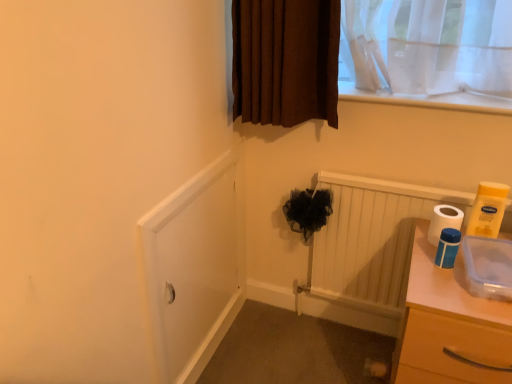
Question: Is blue plastic toilet paper at right, which is the third toilet paper from right to left, completely or partially inside white glossy toilet paper at right, which is counted as the 3th toilet paper, starting from the left?

Choices:
 (A) no
 (B) yes

Answer: (A)

Question: Are white glossy toilet paper at right, the first toilet paper when ordered from right to left, and blue plastic toilet paper at right, marked as the first toilet paper in a left-to-right arrangement, beside each other?

Choices:
 (A) no
 (B) yes

Answer: (A)

Question: Is white glossy toilet paper at right, which is counted as the 3th toilet paper, starting from the left, positioned in front of blue plastic toilet paper at right, which is the third toilet paper from right to left?

Choices:
 (A) yes
 (B) no

Answer: (B)

Question: Is white glossy toilet paper at right, which is counted as the 3th toilet paper, starting from the left, oriented away from blue plastic toilet paper at right, marked as the first toilet paper in a left-to-right arrangement?

Choices:
 (A) yes
 (B) no

Answer: (B)

Question: Could you tell me if white glossy toilet paper at right, the first toilet paper when ordered from right to left, is turned towards blue plastic toilet paper at right, marked as the first toilet paper in a left-to-right arrangement?

Choices:
 (A) no
 (B) yes

Answer: (A)

Question: From the image's perspective, is white matte screen door at lower left above or below white matte toilet paper at right, placed as the second toilet paper when sorted from left to right?

Choices:
 (A) below
 (B) above

Answer: (A)

Question: Is white matte screen door at lower left taller or shorter than white matte toilet paper at right, which ranks as the second toilet paper in right-to-left order?

Choices:
 (A) short
 (B) tall

Answer: (B)

Question: Is white matte screen door at lower left bigger or smaller than white matte toilet paper at right, which ranks as the second toilet paper in right-to-left order?

Choices:
 (A) big
 (B) small

Answer: (A)

Question: Considering the positions of point (185, 345) and point (453, 226), is point (185, 345) closer or farther from the camera than point (453, 226)?

Choices:
 (A) farther
 (B) closer

Answer: (A)

Question: Is clear plastic chest of drawers at right taller or shorter than blue plastic toilet paper at right, marked as the first toilet paper in a left-to-right arrangement?

Choices:
 (A) short
 (B) tall

Answer: (B)

Question: Considering their positions, is clear plastic chest of drawers at right located in front of or behind blue plastic toilet paper at right, which is the third toilet paper from right to left?

Choices:
 (A) front
 (B) behind

Answer: (A)

Question: Visually, is clear plastic chest of drawers at right positioned to the left or to the right of blue plastic toilet paper at right, which is the third toilet paper from right to left?

Choices:
 (A) right
 (B) left

Answer: (A)

Question: Considering the positions of clear plastic chest of drawers at right and blue plastic toilet paper at right, which is the third toilet paper from right to left, in the image, is clear plastic chest of drawers at right wider or thinner than blue plastic toilet paper at right, which is the third toilet paper from right to left,?

Choices:
 (A) thin
 (B) wide

Answer: (B)

Question: From the image's perspective, is blue plastic toilet paper at right, marked as the first toilet paper in a left-to-right arrangement, positioned above or below white matte toilet paper at right, which ranks as the second toilet paper in right-to-left order?

Choices:
 (A) below
 (B) above

Answer: (A)

Question: From a real-world perspective, is blue plastic toilet paper at right, marked as the first toilet paper in a left-to-right arrangement, physically located above or below white matte toilet paper at right, which ranks as the second toilet paper in right-to-left order?

Choices:
 (A) below
 (B) above

Answer: (B)